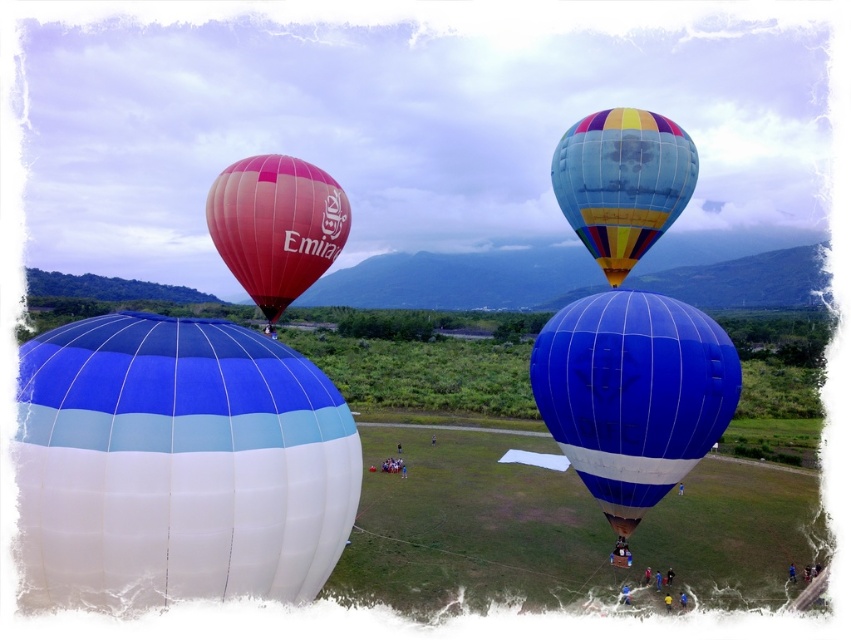
Question: Can you confirm if blue glossy hot air balloon at center is positioned below rainbow striped hot air balloon at upper right?

Choices:
 (A) yes
 (B) no

Answer: (A)

Question: Is the position of blue glossy hot air balloon at center less distant than that of matte pink balloon at center-left?

Choices:
 (A) yes
 (B) no

Answer: (A)

Question: Which point is closer to the camera?

Choices:
 (A) (261, 566)
 (B) (287, 157)
 (C) (630, 528)
 (D) (657, 124)

Answer: (A)

Question: Among these points, which one is farthest from the camera?

Choices:
 (A) (288, 502)
 (B) (535, 353)
 (C) (212, 200)

Answer: (C)

Question: Which object is the closest to the matte pink balloon at center-left?

Choices:
 (A) blue/white striped balloon at lower left
 (B) rainbow striped hot air balloon at upper right

Answer: (B)

Question: Is blue glossy hot air balloon at center to the left of rainbow striped hot air balloon at upper right from the viewer's perspective?

Choices:
 (A) no
 (B) yes

Answer: (B)